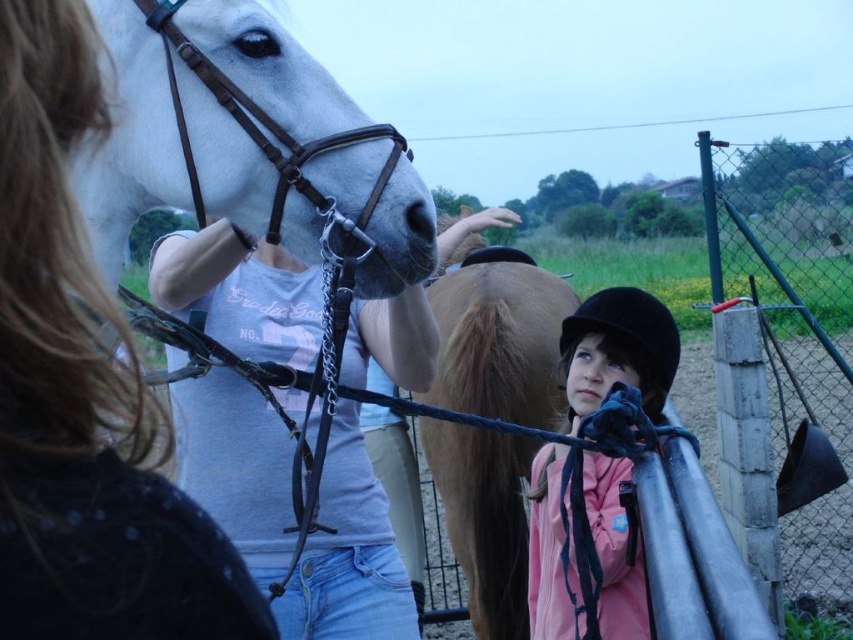
Question: Which of the following is the farthest from the observer?

Choices:
 (A) pink fleece jacket at center
 (B) brown glossy horse at center
 (C) white leather bridle at upper left

Answer: (B)

Question: Can you confirm if metallic chain-link fence at right is positioned to the left of brown glossy horse at center?

Choices:
 (A) no
 (B) yes

Answer: (A)

Question: Which of these objects is positioned farthest from the pink fleece jacket at center?

Choices:
 (A) matte white horse at left
 (B) white leather bridle at upper left
 (C) brown glossy horse at center

Answer: (A)

Question: Which point is farther to the camera?

Choices:
 (A) (44, 598)
 (B) (769, 336)
 (C) (413, 252)
 (D) (555, 618)

Answer: (B)

Question: Is matte white horse at left thinner than metallic chain-link fence at right?

Choices:
 (A) yes
 (B) no

Answer: (A)

Question: Can you confirm if white leather bridle at upper left is thinner than pink fleece jacket at center?

Choices:
 (A) yes
 (B) no

Answer: (B)